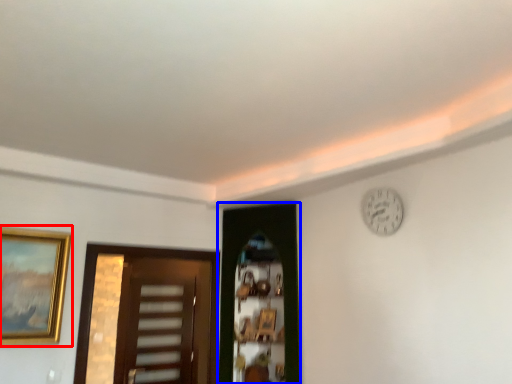
Question: Which of the following is the closest to the observer, picture frame (highlighted by a red box) or door (highlighted by a blue box)?

Choices:
 (A) picture frame
 (B) door

Answer: (A)